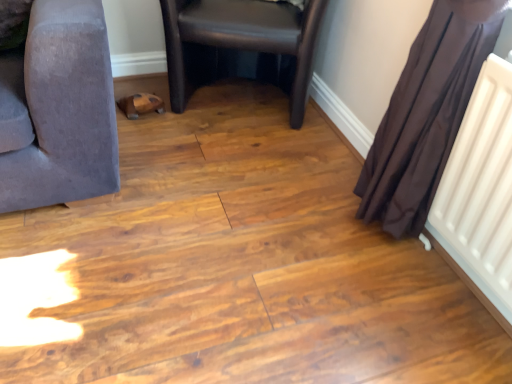
Identify the location of black leather chair at center. (242, 38).

The image size is (512, 384). What do you see at coordinates (242, 38) in the screenshot?
I see `black leather chair at center` at bounding box center [242, 38].

Describe the element at coordinates (426, 114) in the screenshot. Image resolution: width=512 pixels, height=384 pixels. I see `brown sheer curtain at right` at that location.

Locate an element on the screen. This screenshot has width=512, height=384. brown sheer curtain at right is located at coordinates (426, 114).

This screenshot has height=384, width=512. Identify the location of black leather chair at center. (242, 38).

Between black leather chair at center and brown sheer curtain at right, which one appears on the right side from the viewer's perspective?

brown sheer curtain at right is more to the right.

Does black leather chair at center lie behind brown sheer curtain at right?

Yes, black leather chair at center is behind brown sheer curtain at right.

Is point (297, 49) farther from viewer compared to point (401, 145)?

Yes, it is behind point (401, 145).

From the image's perspective, is black leather chair at center positioned above or below brown sheer curtain at right?

black leather chair at center is above brown sheer curtain at right.

From a real-world perspective, does black leather chair at center stand above brown sheer curtain at right?

No, from a real-world perspective, black leather chair at center is not above brown sheer curtain at right.

Does black leather chair at center have a greater width compared to brown sheer curtain at right?

Yes, black leather chair at center is wider than brown sheer curtain at right.

Is black leather chair at center shorter than brown sheer curtain at right?

Correct, black leather chair at center is not as tall as brown sheer curtain at right.

Considering the sizes of objects black leather chair at center and brown sheer curtain at right in the image provided, who is bigger, black leather chair at center or brown sheer curtain at right?

Bigger between the two is black leather chair at center.

Is black leather chair at center spatially inside brown sheer curtain at right, or outside of it?

black leather chair at center lies outside brown sheer curtain at right.

Is black leather chair at center in contact with brown sheer curtain at right?

black leather chair at center and brown sheer curtain at right are clearly separated.

Is brown sheer curtain at right at the back of black leather chair at center?

black leather chair at center is not turned away from brown sheer curtain at right.

How many degrees apart are the facing directions of black leather chair at center and brown sheer curtain at right?

There is a 61.2-degree angle between the facing directions of black leather chair at center and brown sheer curtain at right.

Find the location of `curtain on the right of black leather chair at center`. curtain on the right of black leather chair at center is located at coordinates (426, 114).

Considering the positions of objects brown sheer curtain at right and black leather chair at center in the image provided, who is more to the right, brown sheer curtain at right or black leather chair at center?

Positioned to the right is brown sheer curtain at right.

Which is in front, brown sheer curtain at right or black leather chair at center?

brown sheer curtain at right is more forward.

Between point (373, 217) and point (230, 16), which one is positioned behind?

The point (230, 16) is farther.

From the image's perspective, which one is positioned lower, brown sheer curtain at right or black leather chair at center?

brown sheer curtain at right appears lower in the image.

From a real-world perspective, is brown sheer curtain at right physically located above or below black leather chair at center?

brown sheer curtain at right is situated higher than black leather chair at center in the real world.

Considering the sizes of objects brown sheer curtain at right and black leather chair at center in the image provided, who is thinner, brown sheer curtain at right or black leather chair at center?

Thinner between the two is brown sheer curtain at right.

Does brown sheer curtain at right have a lesser height compared to black leather chair at center?

Incorrect, the height of brown sheer curtain at right does not fall short of that of black leather chair at center.

From the picture: Which of these two, brown sheer curtain at right or black leather chair at center, is smaller?

With smaller size is brown sheer curtain at right.

Looking at this image, is brown sheer curtain at right inside or outside of black leather chair at center?

The correct answer is: outside.

Is brown sheer curtain at right with black leather chair at center?

No, brown sheer curtain at right is not touching black leather chair at center.

Is black leather chair at center at the back of brown sheer curtain at right?

That's not correct — brown sheer curtain at right is not looking away from black leather chair at center.

The image size is (512, 384). I want to click on curtain below the black leather chair at center (from the image's perspective), so click(x=426, y=114).

The image size is (512, 384). I want to click on chair above the brown sheer curtain at right (from the image's perspective), so click(242, 38).

Where is `curtain lying in front of the black leather chair at center`? The height and width of the screenshot is (384, 512). curtain lying in front of the black leather chair at center is located at coordinates (426, 114).